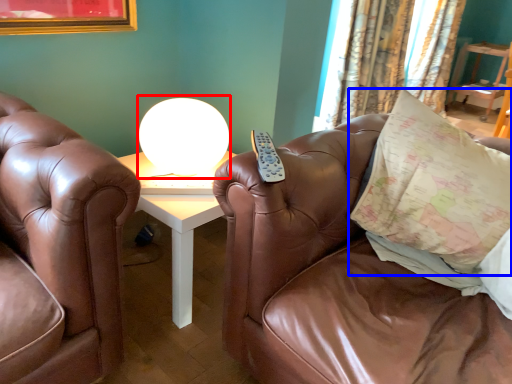
Question: Which point is further to the camera, table lamp (highlighted by a red box) or pillow (highlighted by a blue box)?

Choices:
 (A) table lamp
 (B) pillow

Answer: (A)